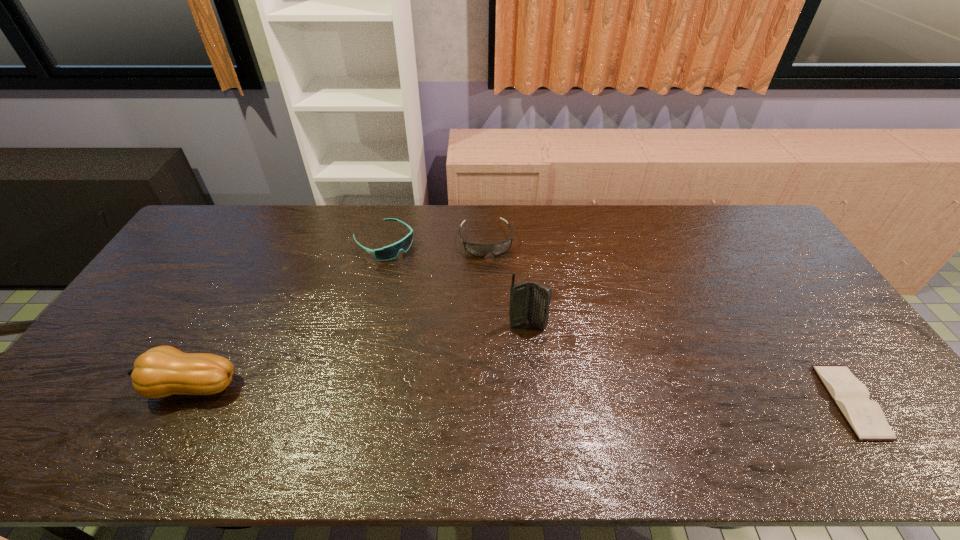
This screenshot has height=540, width=960. I want to click on sunglasses situated at the far edge, so click(x=389, y=252).

You are a GUI agent. You are given a task and a screenshot of the screen. Output one action in this format:
    pyautogui.click(x=<x>, y=<y>)
    Task: Click on the gourd at the near edge
    The height and width of the screenshot is (540, 960).
    Given the screenshot: What is the action you would take?
    pyautogui.click(x=162, y=371)

Find the location of a particular element. diary present at the near edge is located at coordinates (865, 417).

You are a GUI agent. You are given a task and a screenshot of the screen. Output one action in this format:
    pyautogui.click(x=<x>, y=<y>)
    Task: Click on the object that is at the right edge
    The width and height of the screenshot is (960, 540).
    Given the screenshot: What is the action you would take?
    pyautogui.click(x=865, y=417)

Locate an element on the screen. This screenshot has width=960, height=540. object that is at the near right corner is located at coordinates (865, 417).

Where is `vacant space at the far edge of the desktop`? Image resolution: width=960 pixels, height=540 pixels. vacant space at the far edge of the desktop is located at coordinates (676, 212).

This screenshot has height=540, width=960. In the image, there is a desktop. Identify the location of free space at the near edge. (229, 393).

Locate an element on the screen. This screenshot has height=540, width=960. free space at the left edge of the desktop is located at coordinates (108, 376).

The width and height of the screenshot is (960, 540). Identify the location of free space at the right edge of the desktop. (739, 255).

Where is `vacant space at the near right corner`? vacant space at the near right corner is located at coordinates (896, 411).